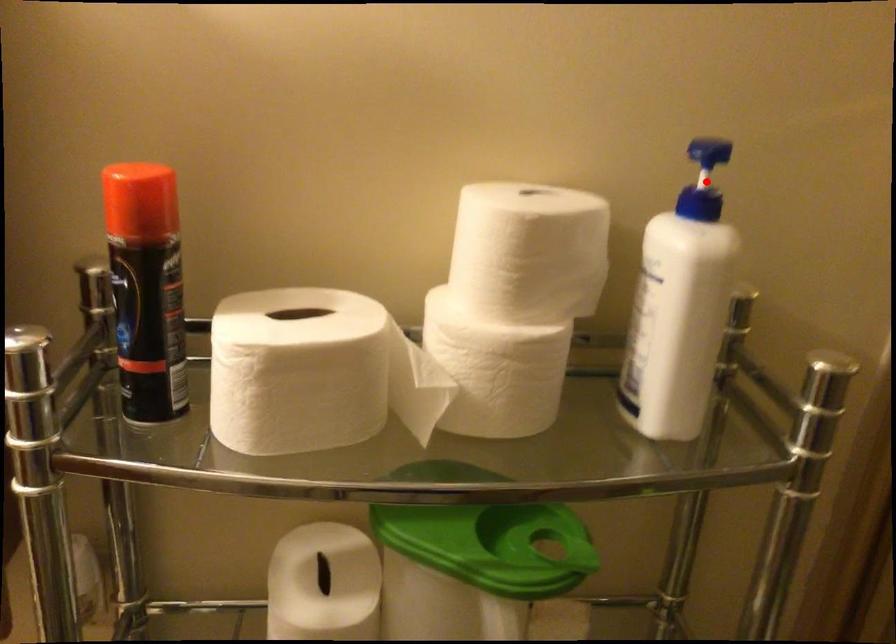
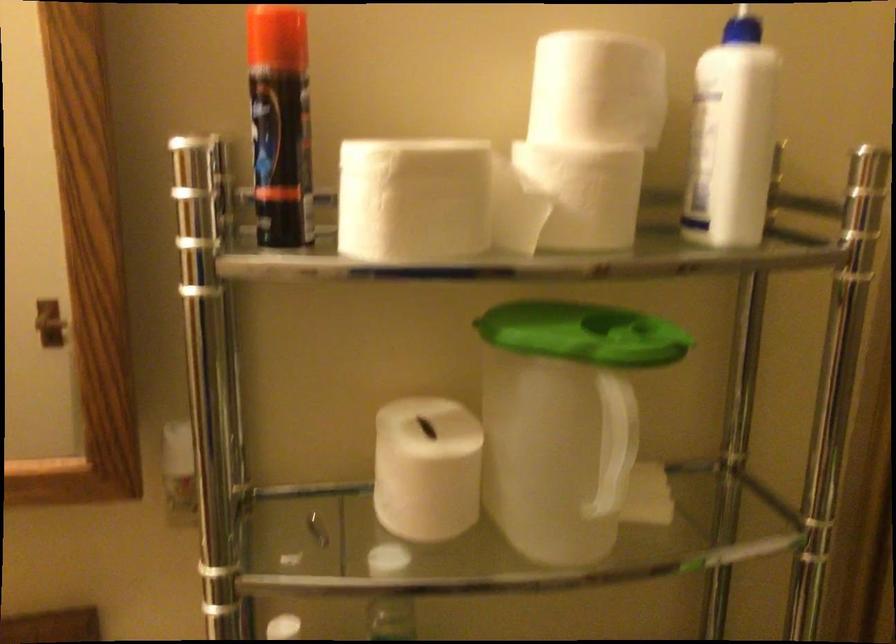
Locate, in the second image, the point that corresponds to the highlighted location in the first image.

(742, 28)